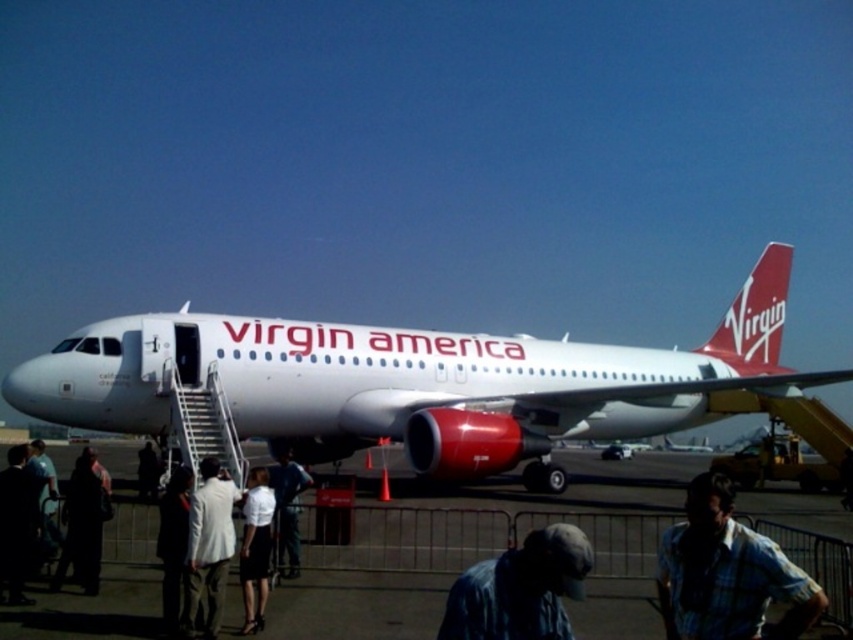
Question: Which of the following is the farthest from the observer?

Choices:
 (A) (682, 504)
 (B) (213, 532)
 (C) (531, 410)
 (D) (178, 563)

Answer: (C)

Question: Is blue plaid shirt at lower right below dark gray fabric jacket at lower left?

Choices:
 (A) yes
 (B) no

Answer: (B)

Question: Where is light beige suit at center located in relation to dark gray fabric jacket at lower left in the image?

Choices:
 (A) left
 (B) right

Answer: (B)

Question: In this image, where is blue plaid shirt at lower right located relative to white fabric skirt at center?

Choices:
 (A) right
 (B) left

Answer: (A)

Question: Which of these objects is positioned farthest from the white glossy airplane at center?

Choices:
 (A) light beige suit at center
 (B) smooth concrete runway at center
 (C) white cotton shirt at lower left

Answer: (C)

Question: Which is nearer to the blue plaid shirt at lower right?

Choices:
 (A) dark fabric coat at lower left
 (B) dark blue jeans at center
 (C) white cotton shirt at lower left

Answer: (B)